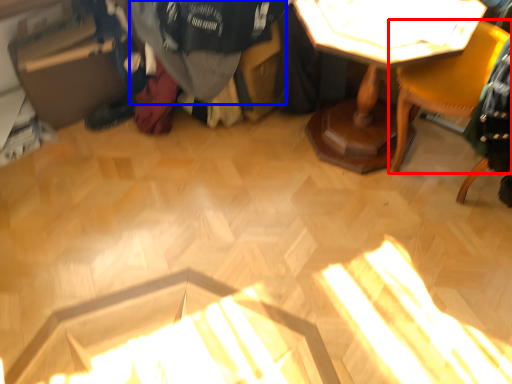
Question: Which point is closer to the camera, chair (highlighted by a red box) or clothing (highlighted by a blue box)?

Choices:
 (A) chair
 (B) clothing

Answer: (A)